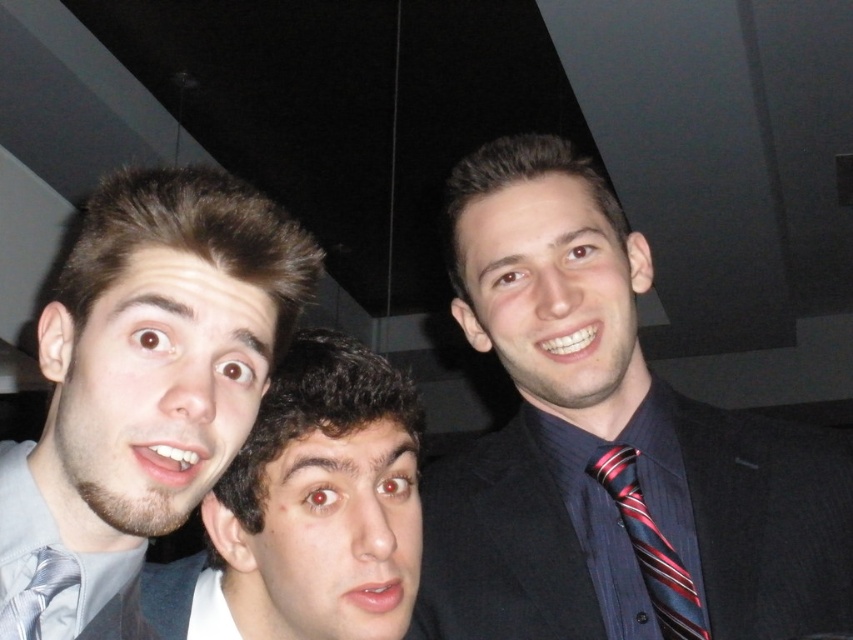
Is dark blue suit at right wider than striped silk tie at right?

Correct, the width of dark blue suit at right exceeds that of striped silk tie at right.

Who is more distant from viewer, (817, 458) or (639, 522)?

The point (817, 458) is behind.

This screenshot has height=640, width=853. I want to click on dark blue suit at right, so click(608, 445).

Is matte gray tie at left shorter than matte gray shirt at center?

No.

Between point (111, 522) and point (340, 557), which one is positioned behind?

The point (340, 557) is behind.

The height and width of the screenshot is (640, 853). I want to click on matte gray tie at left, so click(148, 372).

Can you confirm if matte gray tie at left is positioned above silvery metallic tie at center?

Yes.

Is point (102, 292) closer to camera compared to point (19, 637)?

That is True.

Locate an element on the screen. The height and width of the screenshot is (640, 853). matte gray tie at left is located at coordinates (148, 372).